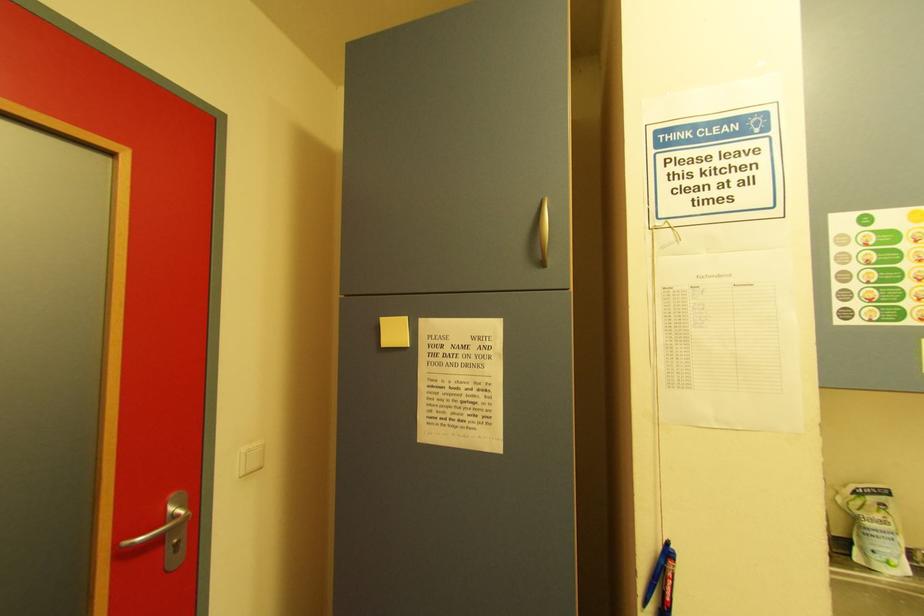
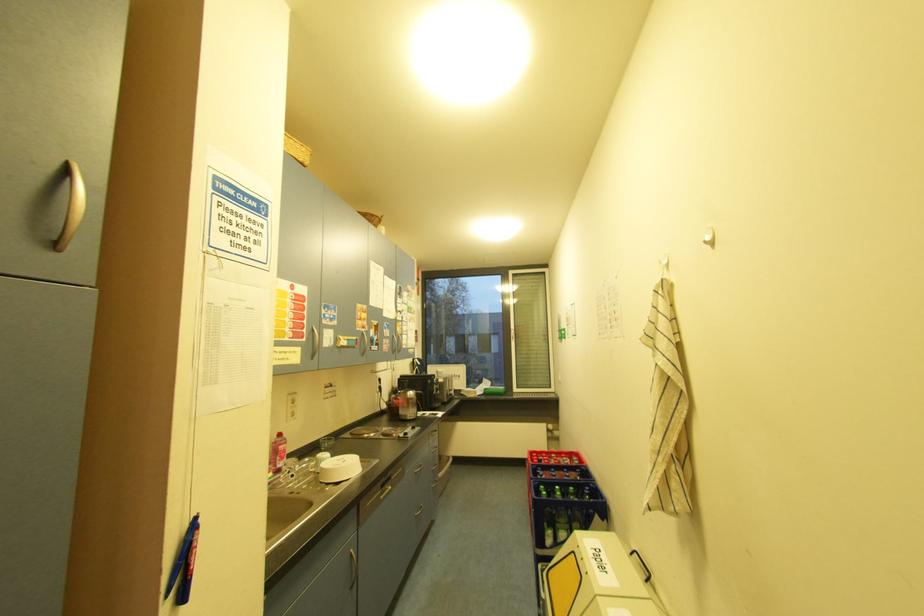
Question: Based on the continuous images, in which direction is the camera rotating? Reply with the corresponding letter.

Choices:
 (A) Left
 (B) Right
 (C) Up
 (D) Down

Answer: (B)